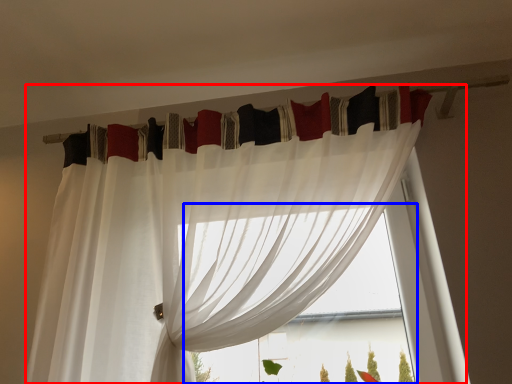
Question: Which point is further to the camera, curtain (highlighted by a red box) or bay window (highlighted by a blue box)?

Choices:
 (A) curtain
 (B) bay window

Answer: (B)